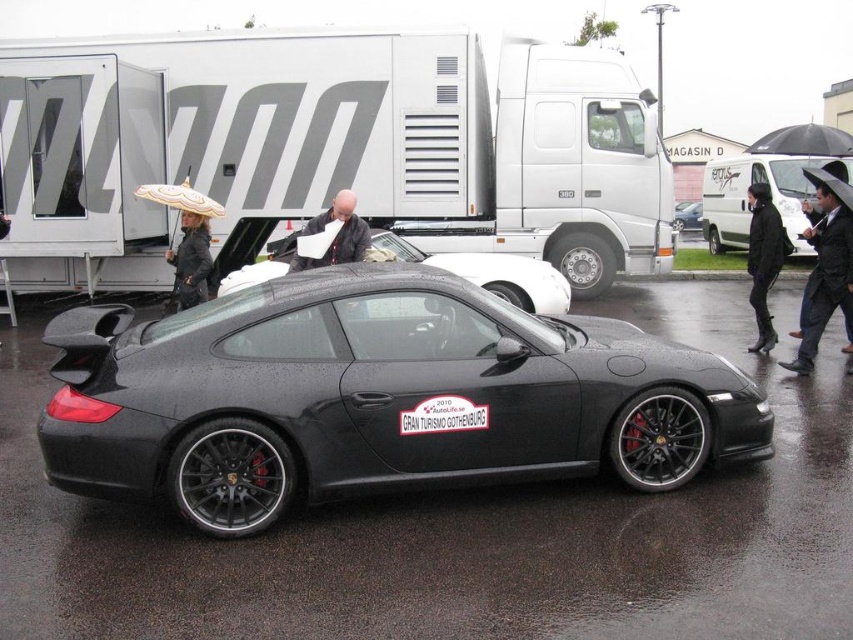
Question: Which of the following is the closest to the observer?

Choices:
 (A) white matte umbrella at upper left
 (B) dark suit at center

Answer: (B)

Question: Which of the following is the closest to the observer?

Choices:
 (A) [x=335, y=257]
 (B) [x=581, y=232]

Answer: (A)

Question: Observing the image, what is the correct spatial positioning of glossy black sports car at center in reference to dark suit at center?

Choices:
 (A) above
 (B) below

Answer: (B)

Question: Is white matte van at center to the right of shiny black car at center from the viewer's perspective?

Choices:
 (A) no
 (B) yes

Answer: (B)

Question: Which of the following is the farthest from the observer?

Choices:
 (A) (347, 364)
 (B) (677, 228)
 (C) (274, 266)
 (D) (305, 227)

Answer: (B)

Question: Is matte black jacket at center to the left of shiny black car at center from the viewer's perspective?

Choices:
 (A) yes
 (B) no

Answer: (A)